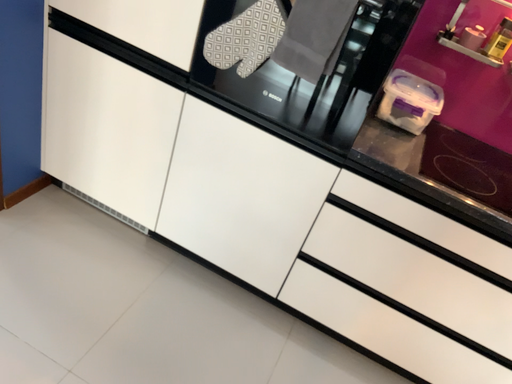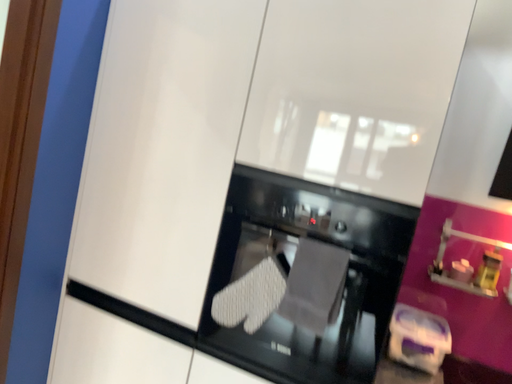
Question: How did the camera likely rotate when shooting the video?

Choices:
 (A) rotated upward
 (B) rotated downward

Answer: (A)